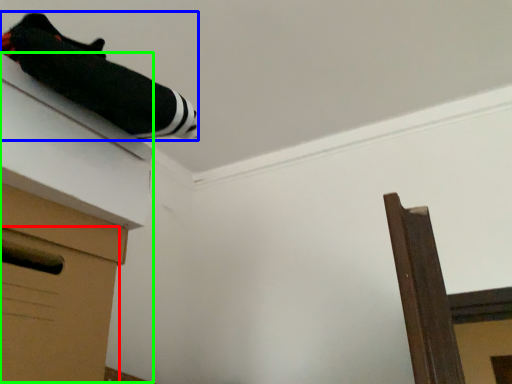
Question: Based on their relative distances, which object is farther from drawer (highlighted by a red box)? Choose from twin (highlighted by a blue box) and vanity (highlighted by a green box).

Choices:
 (A) twin
 (B) vanity

Answer: (A)